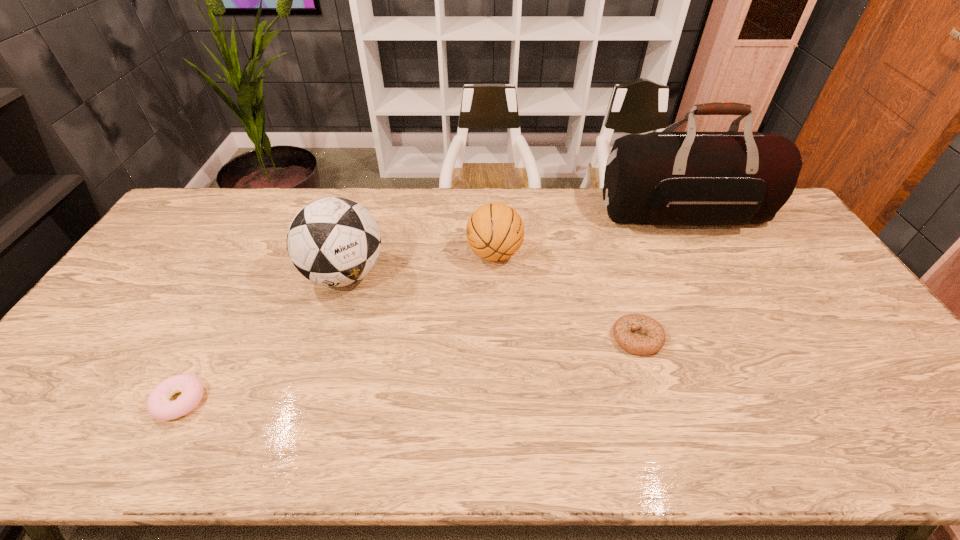
Find the location of a particular element. The image size is (960, 540). free space at the near edge of the desktop is located at coordinates (657, 457).

I want to click on vacant space at the left edge, so click(206, 238).

Locate an element on the screen. free space at the right edge of the desktop is located at coordinates (821, 287).

In the image, there is a desktop. Identify the location of vacant space at the far left corner. (205, 189).

In the image, there is a desktop. Identify the location of vacant region at the far right corner. (767, 227).

Locate an element on the screen. The width and height of the screenshot is (960, 540). vacant area that lies between the third object from left to right and the fourth farthest object is located at coordinates (566, 296).

Image resolution: width=960 pixels, height=540 pixels. I want to click on vacant space that's between the doughnut and the tallest object, so click(432, 308).

The image size is (960, 540). Identify the location of free space between the fourth object from right to left and the second nearest object. (492, 306).

Identify the location of free space between the duffel bag and the nearest object. The height and width of the screenshot is (540, 960). (432, 308).

Find the location of `empty space between the second tallest object and the second nearest object`. empty space between the second tallest object and the second nearest object is located at coordinates (492, 306).